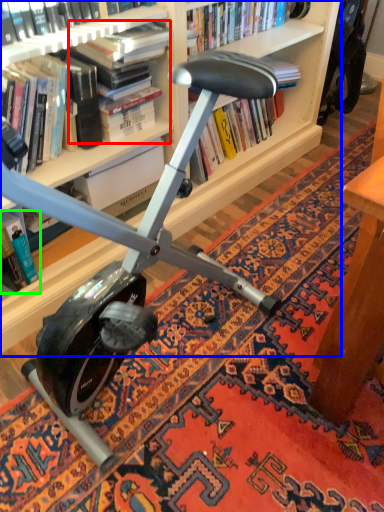
Question: Based on their relative distances, which object is nearer to book (highlighted by a red box)? Choose from bookcase (highlighted by a blue box) and book (highlighted by a green box).

Choices:
 (A) bookcase
 (B) book

Answer: (A)